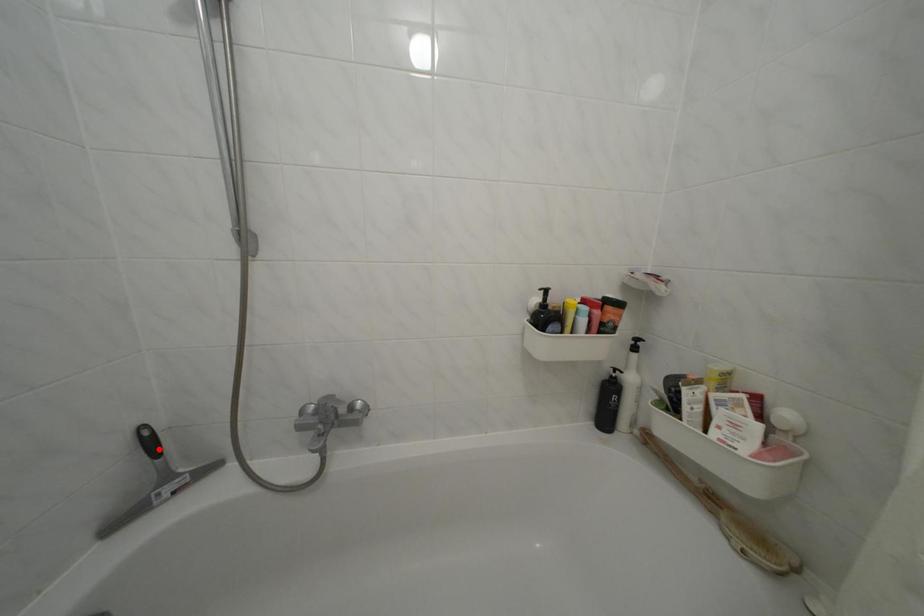
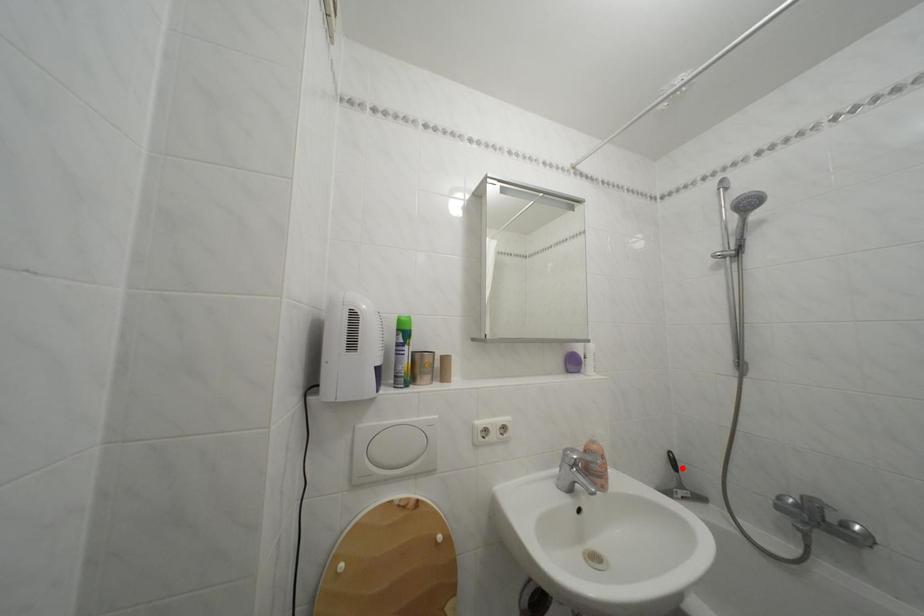
I am providing you with two images of the same scene from different viewpoints. A red point is marked on the first image and another point is marked on the second image. Do the highlighted points in image1 and image2 indicate the same real-world spot?

Yes